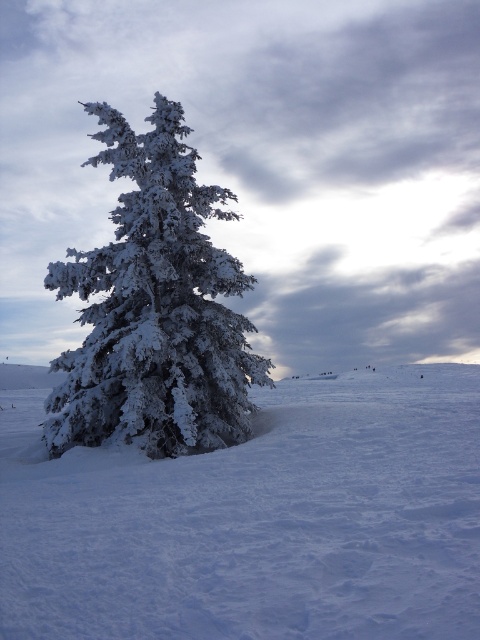
Can you confirm if white fluffy snow at center is positioned above white frosty tree at center?

No.

Between point (288, 420) and point (220, 353), which one is positioned behind?

Positioned behind is point (220, 353).

What are the coordinates of `white fluffy snow at center` in the screenshot? It's located at (256, 520).